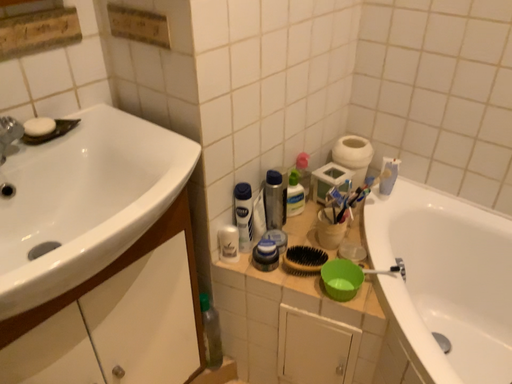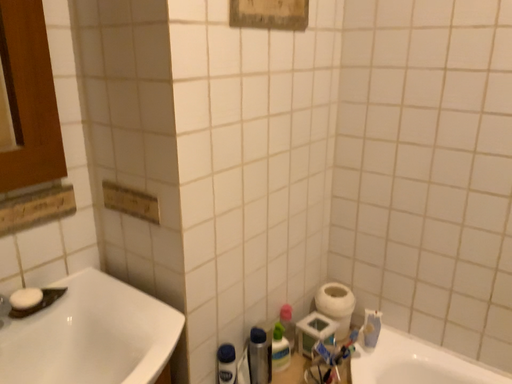
Question: Which way did the camera rotate in the video?

Choices:
 (A) rotated downward
 (B) rotated upward

Answer: (B)